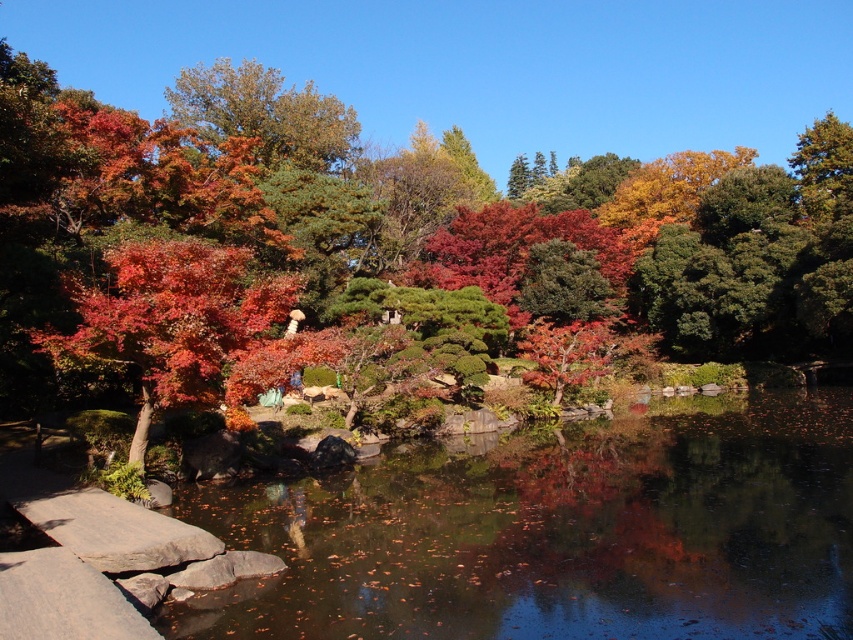
Question: Is glossy reflective water at center above shiny red maple tree at center?

Choices:
 (A) yes
 (B) no

Answer: (B)

Question: Does glossy reflective water at center have a larger size compared to shiny red maple tree at center?

Choices:
 (A) yes
 (B) no

Answer: (A)

Question: Which point is closer to the camera?

Choices:
 (A) (157, 380)
 (B) (573, 545)

Answer: (B)

Question: Which of the following is the closest to the observer?

Choices:
 (A) shiny red maple tree at center
 (B) glossy reflective water at center

Answer: (B)

Question: Can you confirm if glossy reflective water at center is bigger than shiny red maple tree at center?

Choices:
 (A) no
 (B) yes

Answer: (B)